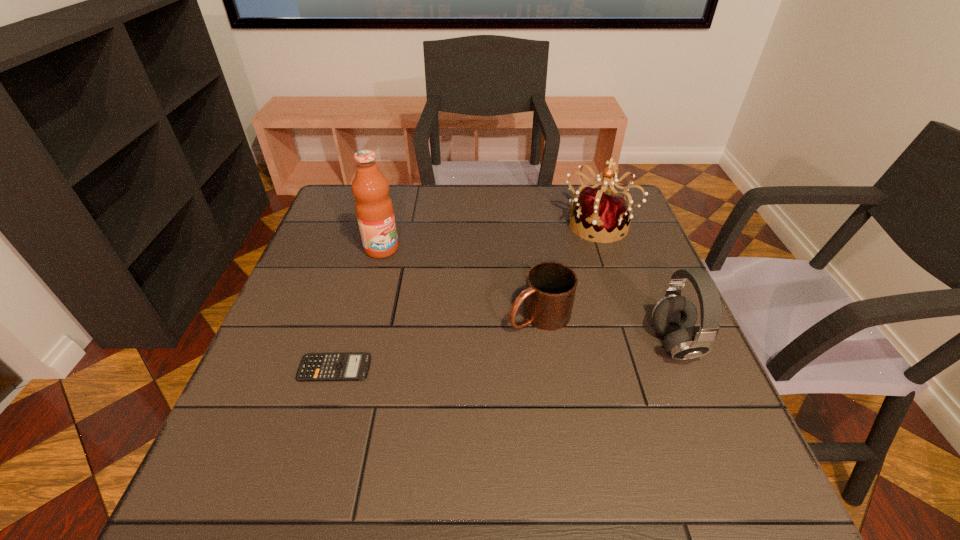
At what (x,y) coordinates should I click in order to perform the action: click on vacant space on the desktop that is between the shortest object and the headset and is positioned on the front-facing side of the tiara. Please return your answer as a coordinate pair (x, y). Looking at the image, I should click on (521, 355).

This screenshot has height=540, width=960. Find the location of `free space on the desktop that is between the calculator and the headset and is positioned on the side of the mug with the handle`. free space on the desktop that is between the calculator and the headset and is positioned on the side of the mug with the handle is located at coordinates (460, 359).

Where is `free space on the desktop that is between the shortest object and the headset and is positioned on the front label of the tallest object`? Image resolution: width=960 pixels, height=540 pixels. free space on the desktop that is between the shortest object and the headset and is positioned on the front label of the tallest object is located at coordinates click(527, 354).